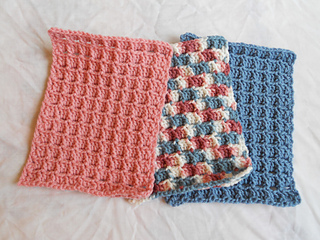
Locate an element on the screen. This screenshot has width=320, height=240. lower white bedding is located at coordinates (156, 212).